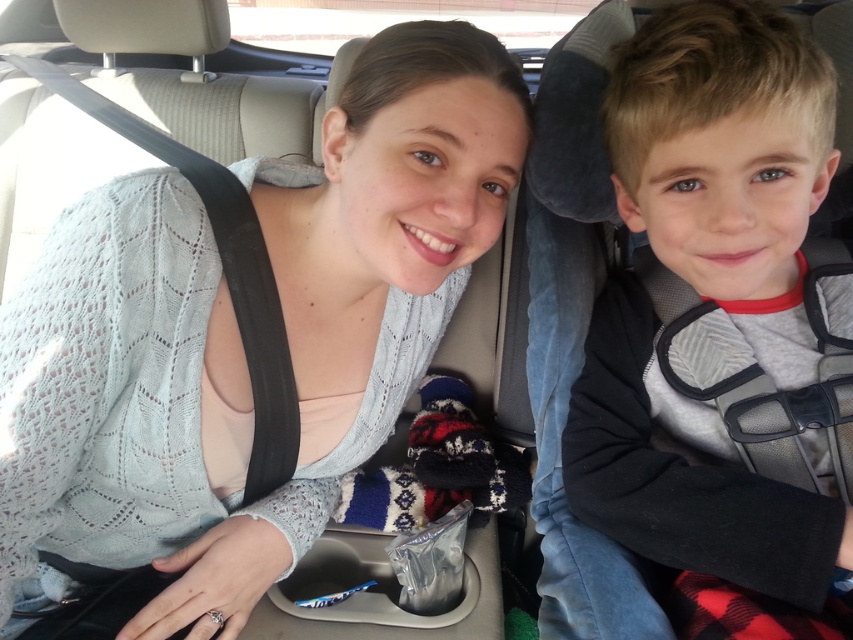
Is light blue knitted sweater at center to the right of gray fleece jacket at right from the viewer's perspective?

No, light blue knitted sweater at center is not to the right of gray fleece jacket at right.

Can you confirm if light blue knitted sweater at center is shorter than gray fleece jacket at right?

No.

Find the location of `light blue knitted sweater at center`. light blue knitted sweater at center is located at coordinates (241, 337).